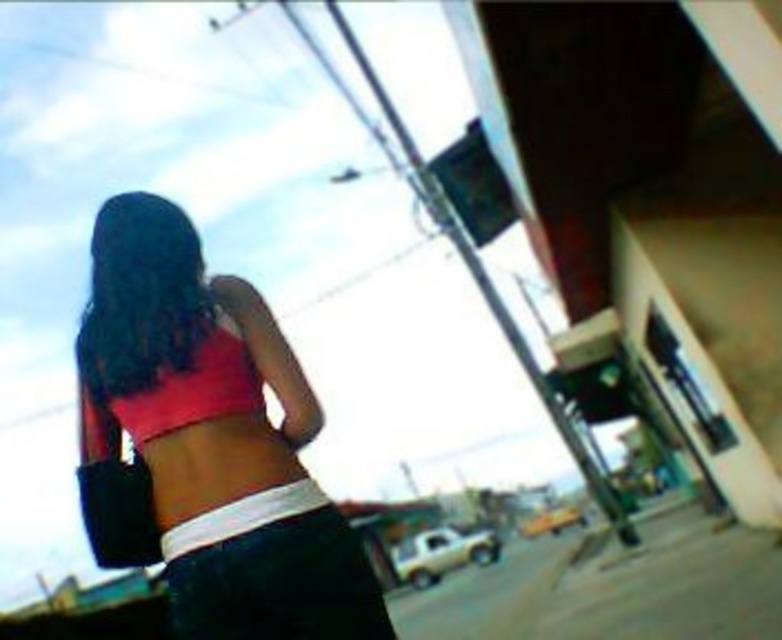
Question: Which point is closer to the camera taking this photo?

Choices:
 (A) (214, 417)
 (B) (178, 444)

Answer: (A)

Question: Which point is closer to the camera taking this photo?

Choices:
 (A) click(156, 390)
 (B) click(183, 419)

Answer: (B)

Question: Is pink fabric top at center bigger than pink matte bikini top at center?

Choices:
 (A) no
 (B) yes

Answer: (B)

Question: Is pink fabric top at center closer to the viewer compared to pink matte bikini top at center?

Choices:
 (A) yes
 (B) no

Answer: (A)

Question: Which point appears closest to the camera in this image?

Choices:
 (A) (156, 477)
 (B) (226, 339)

Answer: (A)

Question: Can you confirm if pink fabric top at center is positioned to the left of pink matte bikini top at center?

Choices:
 (A) yes
 (B) no

Answer: (B)